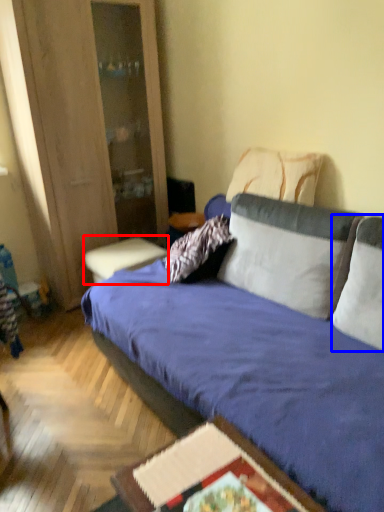
Question: Which object is closer to the camera taking this photo, table (highlighted by a red box) or pillow (highlighted by a blue box)?

Choices:
 (A) table
 (B) pillow

Answer: (B)